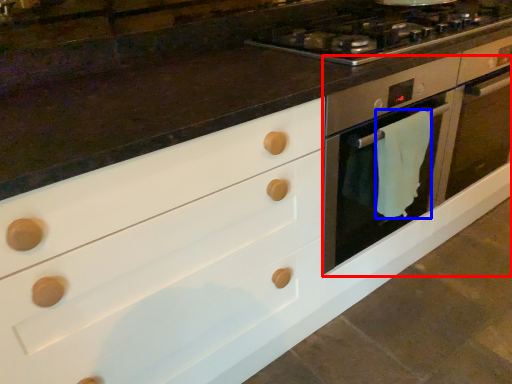
Question: Which of the following is the farthest to the observer, oven (highlighted by a red box) or material (highlighted by a blue box)?

Choices:
 (A) oven
 (B) material

Answer: (A)